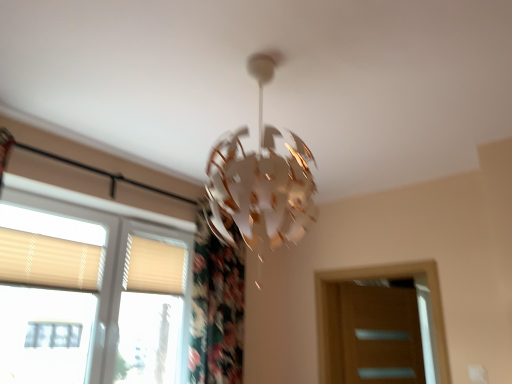
Question: Choose the correct answer: Is beige fabric shutter at lower left, the first shutter in the right-to-left sequence, inside beige textured blinds at left or outside it?

Choices:
 (A) inside
 (B) outside

Answer: (A)

Question: Is point (159, 286) positioned closer to the camera than point (64, 354)?

Choices:
 (A) closer
 (B) farther

Answer: (B)

Question: Estimate the real-world distances between objects in this image. Which object is closer to the beige fabric shutter at lower left, positioned as the 2th shutter in left-to-right order?

Choices:
 (A) beige textured blinds at left
 (B) beige fabric shutter at left, the 2th shutter when ordered from back to front
 (C) brown wooden screen door at lower right

Answer: (A)

Question: Which object is positioned closest to the beige fabric shutter at left, the 1th shutter viewed from the front?

Choices:
 (A) beige textured blinds at left
 (B) beige fabric shutter at lower left, the first shutter in the right-to-left sequence
 (C) brown wooden screen door at lower right

Answer: (A)